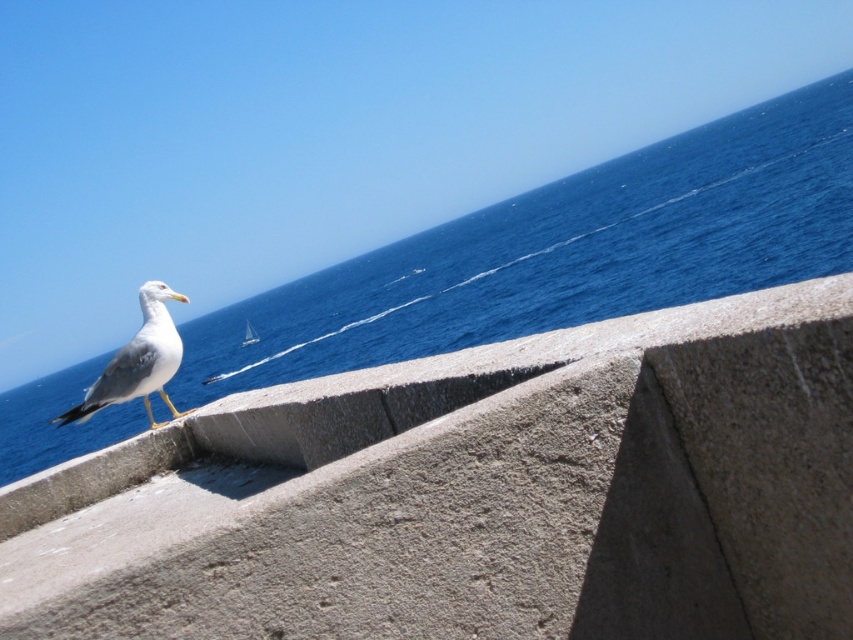
You are standing at the point with coordinates point (152, 422) and want to move towards the seagull on the concrete block. Which direction should you move relative to point (350, 403)?

You should move towards point (350, 403) because it is in front of point (152, 422), so moving towards it would lead you closer to the seagull.